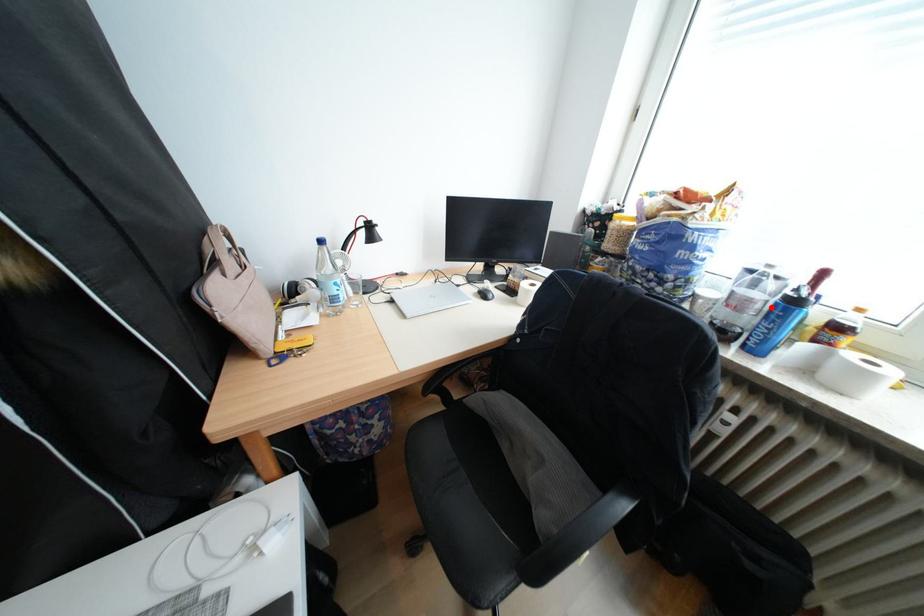
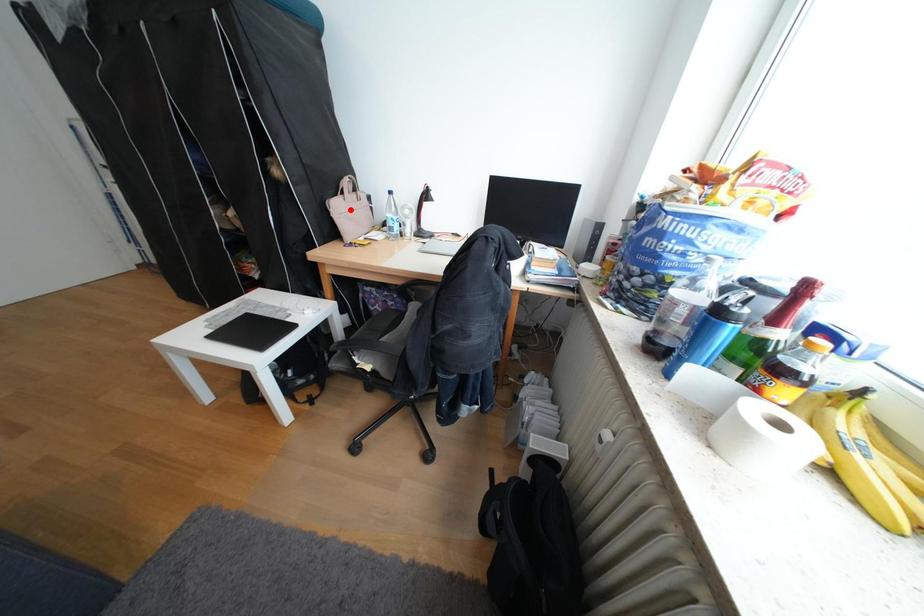
I am providing you with two images of the same scene from different viewpoints. A red point is marked on the first image and another point is marked on the second image. Is the marked point in image1 the same physical position as the marked point in image2?

No